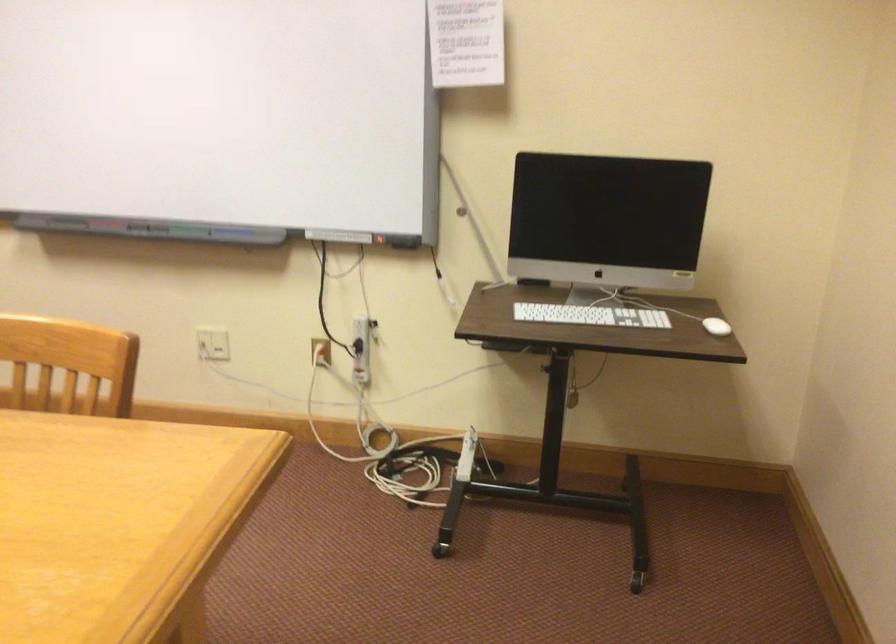
At what (x,y) coordinates should I click in order to perform the action: click on white computer mouse. Please return your answer as a coordinate pair (x, y). The image size is (896, 644). Looking at the image, I should click on (716, 326).